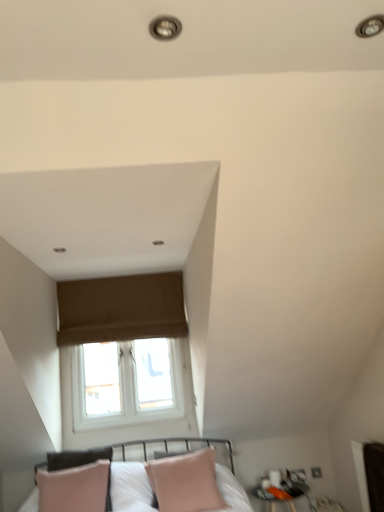
Question: Does point (87, 339) appear closer or farther from the camera than point (261, 495)?

Choices:
 (A) farther
 (B) closer

Answer: (A)

Question: In terms of height, does brown fabric window at upper center look taller or shorter compared to matte black side table at lower right?

Choices:
 (A) short
 (B) tall

Answer: (B)

Question: Based on their relative distances, which object is farther from the matte black side table at lower right?

Choices:
 (A) pink leather pillow at lower center
 (B) brown fabric window at upper center

Answer: (B)

Question: Based on their relative distances, which object is farther from the pink leather pillow at lower center?

Choices:
 (A) matte black side table at lower right
 (B) brown fabric window at upper center

Answer: (B)